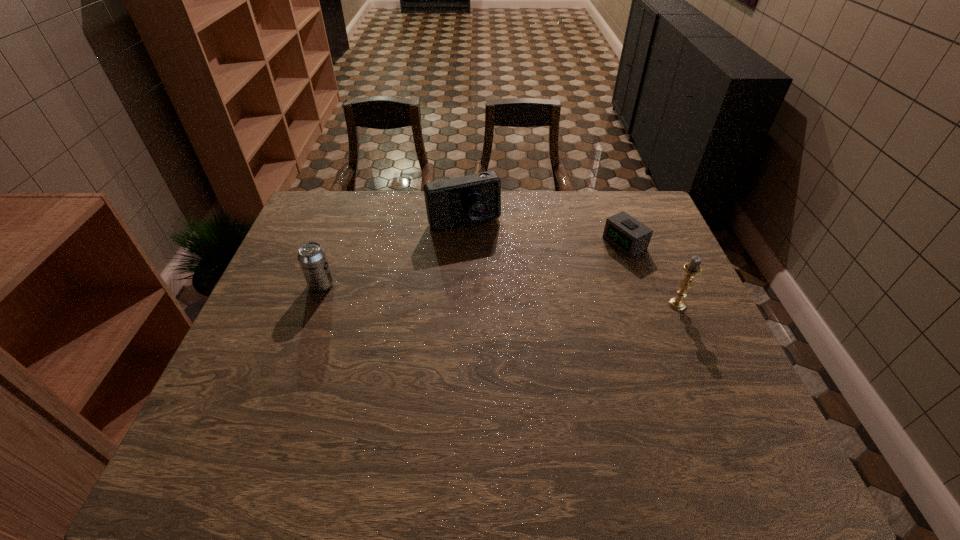
Identify the location of free space on the desktop that is between the third farthest object and the nearest object and is positioned on the front-facing side of the second object from left to right. This screenshot has height=540, width=960. [495, 294].

Find the location of a particular element. The width and height of the screenshot is (960, 540). free space on the desktop that is between the second nearest object and the nearest object and is positioned on the front-facing side of the shortest object is located at coordinates (518, 295).